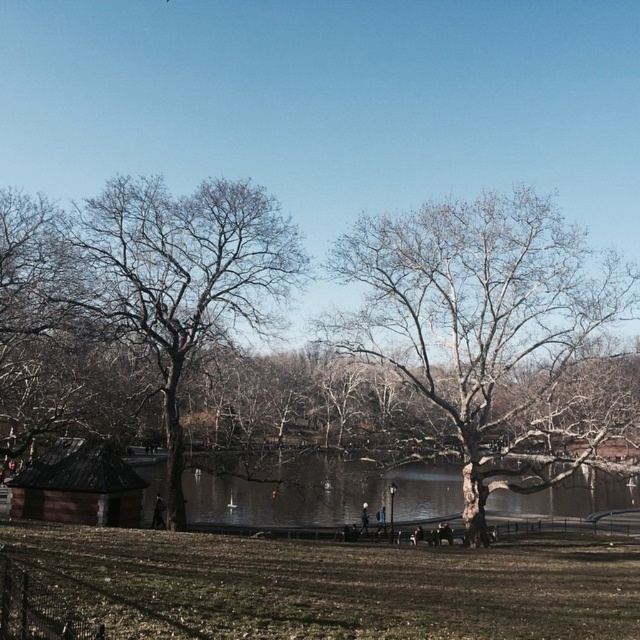
Consider the image. You are a park visitor who wants to take a photo of the clear water at center. You notice the bare wood tree at left might block your view. Can you confirm if the tree is smaller than the water area in the image?

The bare wood tree at left is smaller than clear water at center, so it won

You are a bird flying over the park and want to land on the bare wood tree at center. Can you see the clear water at center from your landing spot?

Yes, because the bare wood tree at center is above clear water at center, so when you land on the bare wood tree at center, you can see the clear water at center below you.

You are standing in the park and want to find the point at coordinates (490, 333). According to the scene, where is this point located?

The point at coordinates (490, 333) is located on the bare wood tree at center.